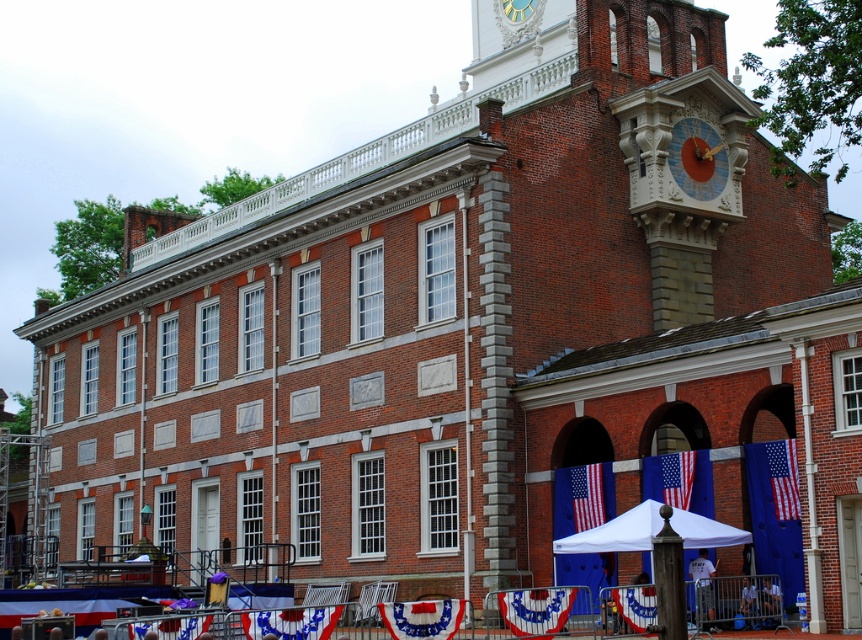
Based on the photo, who is lower down, blue painted wood clock at upper right or red fabric banner at center?

red fabric banner at center is below.

Can you confirm if blue painted wood clock at upper right is thinner than red fabric banner at center?

Indeed, blue painted wood clock at upper right has a lesser width compared to red fabric banner at center.

Who is more distant from viewer, (703,180) or (442,611)?

Positioned behind is point (703,180).

Find the location of a particular element. This screenshot has width=862, height=640. blue painted wood clock at upper right is located at coordinates (697, 157).

This screenshot has width=862, height=640. What do you see at coordinates (697, 157) in the screenshot?
I see `blue painted wood clock at upper right` at bounding box center [697, 157].

Which of these two, blue painted wood clock at upper right or gold metallic clock at upper center, stands shorter?

With less height is gold metallic clock at upper center.

Find the location of a particular element. blue painted wood clock at upper right is located at coordinates (697, 157).

Is red fabric banner at center in front of gold metallic clock at upper center?

Yes, red fabric banner at center is closer to the viewer.

Is red fabric banner at center above gold metallic clock at upper center?

No.

Between point (408, 609) and point (508, 8), which one is positioned behind?

The point (508, 8) is more distant.

You are a GUI agent. You are given a task and a screenshot of the screen. Output one action in this format:
    pyautogui.click(x=<x>, y=<y>)
    Task: Click on the red fabric banner at center
    The height and width of the screenshot is (640, 862).
    Given the screenshot: What is the action you would take?
    pyautogui.click(x=422, y=618)